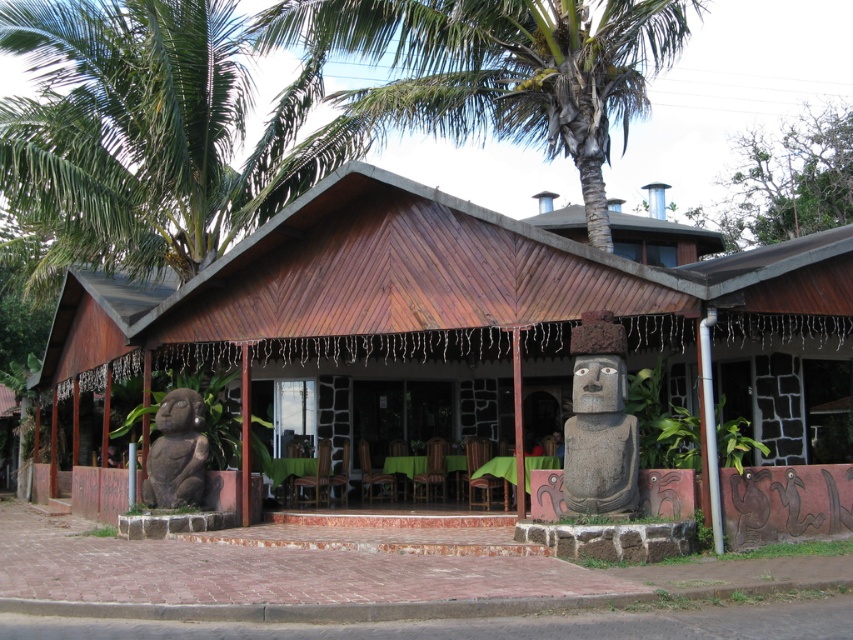
Question: Is green leafy palm tree at upper center further to camera compared to silver metallic pipe at right?

Choices:
 (A) no
 (B) yes

Answer: (B)

Question: Can you confirm if polished stone statue at center is positioned above silver metallic pipe at right?

Choices:
 (A) no
 (B) yes

Answer: (B)

Question: Which point is closer to the camera?

Choices:
 (A) (723, 260)
 (B) (582, 186)
 (C) (160, 460)
 (D) (711, 360)

Answer: (D)

Question: Estimate the real-world distances between objects in this image. Which object is farther from the silver metallic pipe at right?

Choices:
 (A) green leafy palm tree at upper center
 (B) green leafy palm tree at upper left

Answer: (B)

Question: Does green leafy palm tree at upper left lie behind silver metallic pipe at right?

Choices:
 (A) no
 (B) yes

Answer: (B)

Question: Which point is farther to the camera?

Choices:
 (A) (422, 77)
 (B) (711, 470)

Answer: (A)